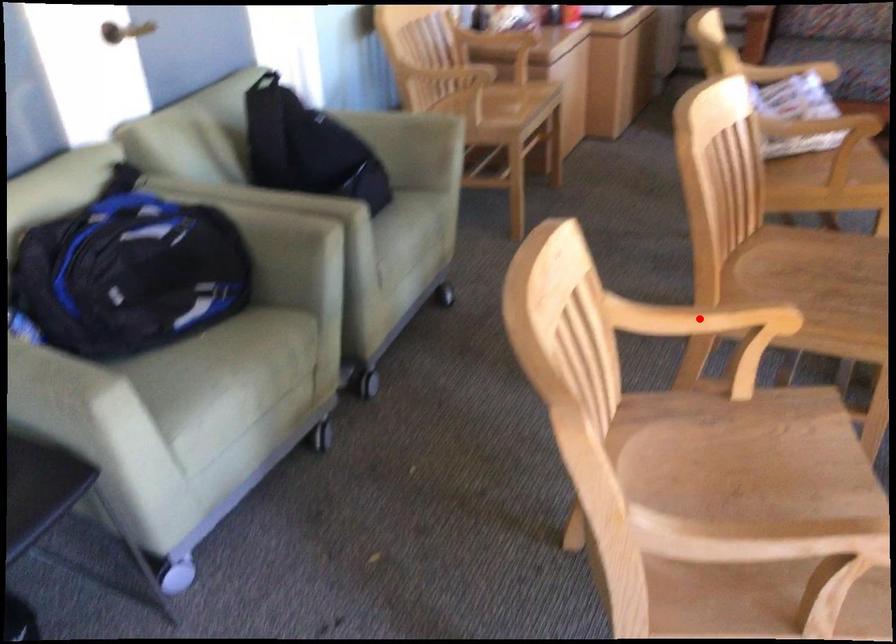
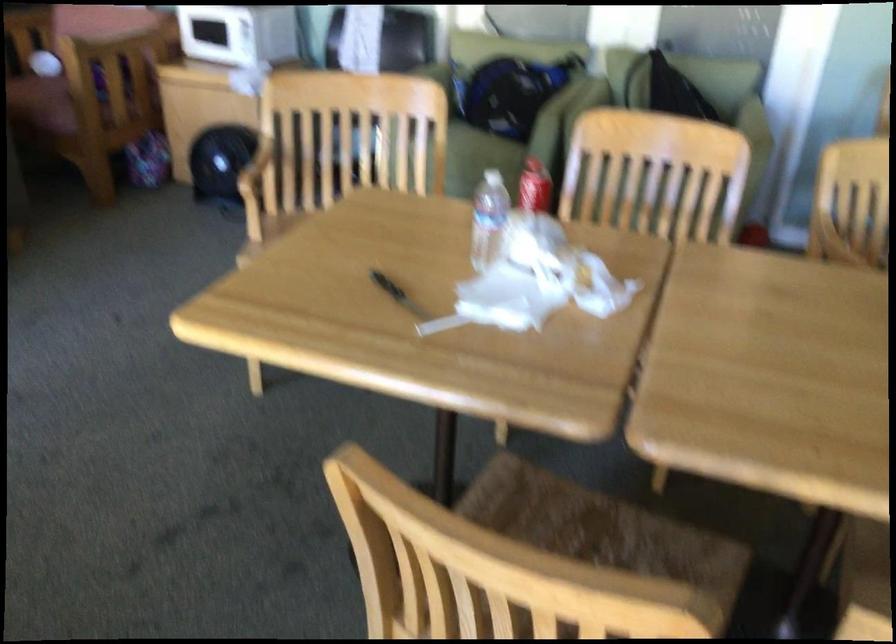
Question: I am providing you with two images of the same scene from different viewpoints. A red point is marked on the first image. At the location where the point appears in image 1, is it still visible in image 2?

Choices:
 (A) Yes
 (B) No

Answer: (B)